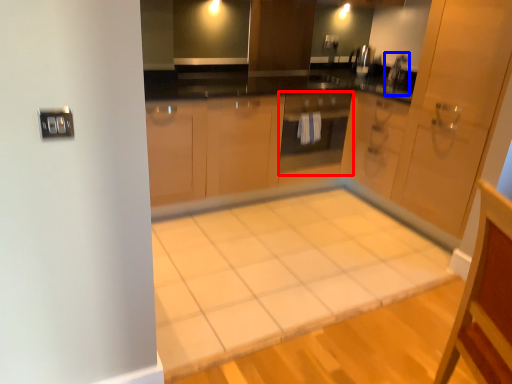
Question: Among these objects, which one is farthest to the camera, oven (highlighted by a red box) or faucet (highlighted by a blue box)?

Choices:
 (A) oven
 (B) faucet

Answer: (B)